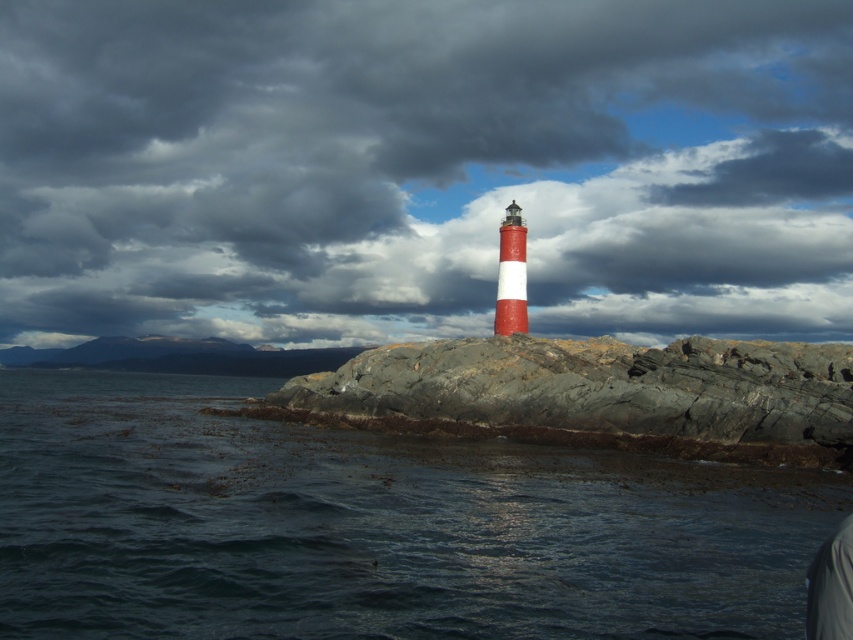
Question: Which point is closer to the camera taking this photo?

Choices:
 (A) (355, 410)
 (B) (177, 163)

Answer: (A)

Question: Observing the image, what is the correct spatial positioning of dark blue water at lower center in reference to rough granite rock at center?

Choices:
 (A) left
 (B) right

Answer: (A)

Question: Which point is farther to the camera?

Choices:
 (A) rough granite rock at center
 (B) dark gray cloud at center
 (C) dark blue water at lower center

Answer: (B)

Question: Is dark gray cloud at center below dark blue water at lower center?

Choices:
 (A) no
 (B) yes

Answer: (A)

Question: Is dark gray cloud at center smaller than rough granite rock at center?

Choices:
 (A) yes
 (B) no

Answer: (B)

Question: Which of the following is the closest to the observer?

Choices:
 (A) dark gray cloud at center
 (B) rough granite rock at center
 (C) dark blue water at lower center

Answer: (C)